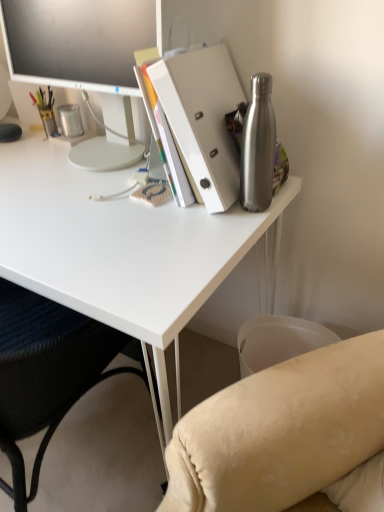
This screenshot has height=512, width=384. Describe the element at coordinates (70, 120) in the screenshot. I see `metallic silver pen holder at left` at that location.

Measure the distance between white glossy monitor at upper left and camera.

The distance of white glossy monitor at upper left from camera is 34.45 inches.

Identify the location of white matte desk at upper center. (117, 246).

From the image's perspective, is brushed metal water bottle at right located above or below white matte folder at upper right?

Based on their image positions, brushed metal water bottle at right is located beneath white matte folder at upper right.

Considering the positions of points (272, 110) and (179, 53), is point (272, 110) closer to camera compared to point (179, 53)?

No, (272, 110) is behind (179, 53).

Could you tell me if beige fabric chair at lower left is turned towards white glossy monitor at upper left?

No, beige fabric chair at lower left is not facing towards white glossy monitor at upper left.

From the image's perspective, is beige fabric chair at lower left on top of white glossy monitor at upper left?

No, from the image's perspective, beige fabric chair at lower left is not above white glossy monitor at upper left.

Which object is further away from the camera, beige fabric chair at lower left or white glossy monitor at upper left?

white glossy monitor at upper left is behind.

Is the position of metallic silver pen holder at left less distant than that of white matte folder at upper right?

No, it is behind white matte folder at upper right.

Consider the image. Which of these two, metallic silver pen holder at left or white matte folder at upper right, is bigger?

Bigger between the two is white matte folder at upper right.

Could you tell me if metallic silver pen holder at left is turned towards white matte folder at upper right?

No.

Based on the photo, considering the positions of objects metallic silver pen holder at left and white matte folder at upper right in the image provided, who is more to the left, metallic silver pen holder at left or white matte folder at upper right?

From the viewer's perspective, metallic silver pen holder at left appears more on the left side.

Looking at this image, is metallic silver pen holder at left not close to white glossy monitor at upper left?

Actually, metallic silver pen holder at left and white glossy monitor at upper left are a little close together.

Is point (69, 119) farther from camera compared to point (123, 12)?

That is True.

Which object is thinner, metallic silver pen holder at left or white glossy monitor at upper left?

metallic silver pen holder at left.

Between metallic silver pen holder at left and white glossy monitor at upper left, which one appears on the left side from the viewer's perspective?

metallic silver pen holder at left is more to the left.

Where is `desk on the right of beige fabric chair at lower left`? The height and width of the screenshot is (512, 384). desk on the right of beige fabric chair at lower left is located at coordinates (117, 246).

Is the position of white matte desk at upper center less distant than that of beige fabric chair at lower left?

That is False.

From the image's perspective, does white matte desk at upper center appear lower than beige fabric chair at lower left?

Actually, white matte desk at upper center appears above beige fabric chair at lower left in the image.

What's the angular difference between white matte desk at upper center and beige fabric chair at lower left's facing directions?

There is a 177-degree angle between the facing directions of white matte desk at upper center and beige fabric chair at lower left.

Considering the sizes of objects beige fabric chair at lower left and brushed metal water bottle at right in the image provided, who is wider, beige fabric chair at lower left or brushed metal water bottle at right?

Wider between the two is beige fabric chair at lower left.

From the image's perspective, which one is positioned lower, beige fabric chair at lower left or brushed metal water bottle at right?

beige fabric chair at lower left, from the image's perspective.

What's the angular difference between beige fabric chair at lower left and brushed metal water bottle at right's facing directions?

There is a 180-degree angle between the facing directions of beige fabric chair at lower left and brushed metal water bottle at right.

Is point (18, 308) in front of point (272, 190)?

No, (18, 308) is further to viewer.

From a real-world perspective, is brushed metal water bottle at right on white glossy monitor at upper left?

No.

Does brushed metal water bottle at right have a lesser width compared to white glossy monitor at upper left?

Correct, the width of brushed metal water bottle at right is less than that of white glossy monitor at upper left.

I want to click on television above the brushed metal water bottle at right (from the image's perspective), so click(77, 41).

Would you say brushed metal water bottle at right is a long distance from white glossy monitor at upper left?

No.

This screenshot has width=384, height=512. Identify the location of paperback book behind the brushed metal water bottle at right. (202, 119).

Where is `television that appears above the beige fabric chair at lower left (from a real-world perspective)`? The width and height of the screenshot is (384, 512). television that appears above the beige fabric chair at lower left (from a real-world perspective) is located at coordinates (77, 41).

From the image, which object appears to be nearer to white matte desk at upper center, white glossy monitor at upper left or metallic silver pen holder at left?

white glossy monitor at upper left is closer to white matte desk at upper center.

When comparing their distances from white matte folder at upper right, does metallic silver pen holder at left or beige fabric chair at lower left seem closer?

Among the two, metallic silver pen holder at left is located nearer to white matte folder at upper right.

When comparing their distances from brushed metal water bottle at right, does white matte folder at upper right or metallic silver pen holder at left seem closer?

The object closer to brushed metal water bottle at right is white matte folder at upper right.

Based on their spatial positions, is metallic silver pen holder at left or beige fabric chair at lower left further from white matte desk at upper center?

metallic silver pen holder at left.

From the image, which object appears to be farther from brushed metal water bottle at right, white glossy monitor at upper left or beige fabric chair at lower left?

beige fabric chair at lower left is further to brushed metal water bottle at right.

When comparing their distances from metallic silver pen holder at left, does brushed metal water bottle at right or white glossy monitor at upper left seem closer?

Among the two, white glossy monitor at upper left is located nearer to metallic silver pen holder at left.

From the image, which object appears to be farther from beige fabric chair at lower left, metallic silver pen holder at left or white matte folder at upper right?

The object further to beige fabric chair at lower left is metallic silver pen holder at left.

Looking at this image, considering their positions, is white glossy monitor at upper left positioned closer to white matte folder at upper right than metallic silver pen holder at left?

Based on the image, white glossy monitor at upper left appears to be nearer to white matte folder at upper right.

Identify the location of bottle between white glossy monitor at upper left and beige fabric chair at lower left in the vertical direction. Image resolution: width=384 pixels, height=512 pixels. (258, 147).

The width and height of the screenshot is (384, 512). I want to click on paperback book between metallic silver pen holder at left and beige fabric chair at lower left in the vertical direction, so click(202, 119).

Locate an element on the screen. This screenshot has height=512, width=384. television between white matte folder at upper right and metallic silver pen holder at left along the z-axis is located at coordinates (77, 41).

This screenshot has height=512, width=384. I want to click on paperback book that lies between white glossy monitor at upper left and white matte desk at upper center from top to bottom, so click(x=202, y=119).